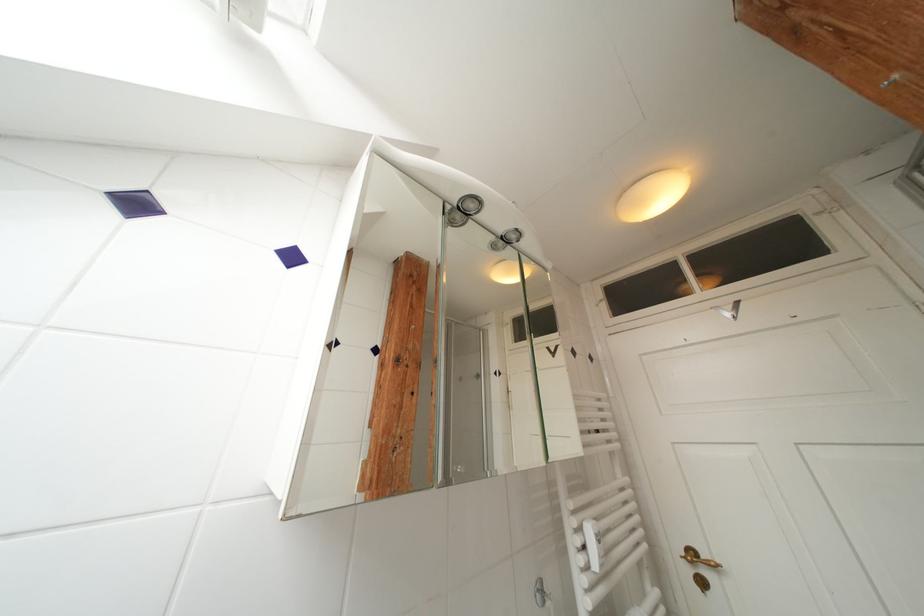
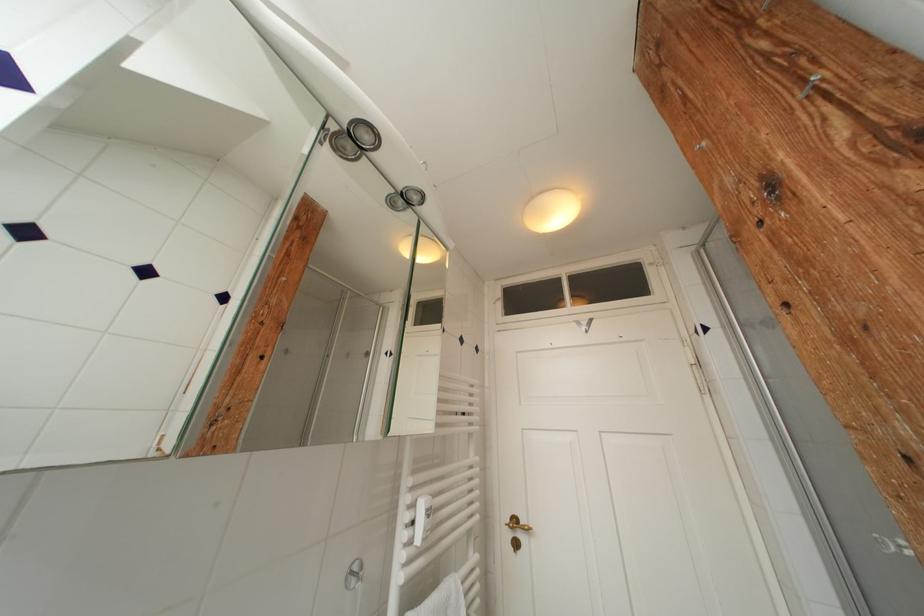
The point at [699,557] is marked in the first image. Where is the corresponding point in the second image?

(521, 525)